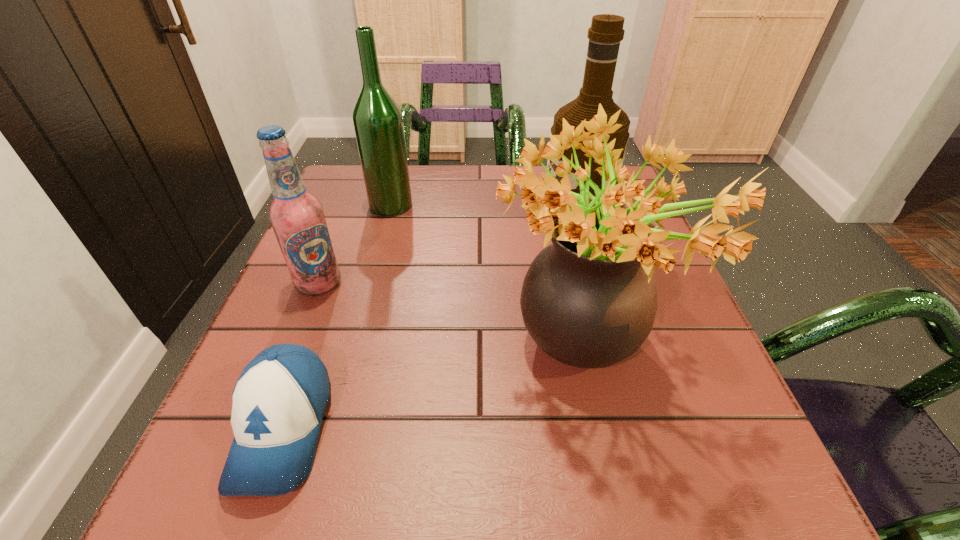
Locate an element on the screen. The height and width of the screenshot is (540, 960). free point at the near edge is located at coordinates (444, 487).

The image size is (960, 540). I want to click on vacant point at the left edge, so click(361, 301).

What are the coordinates of `free space at the right edge of the desktop` in the screenshot? It's located at (684, 321).

Identify the location of free space at the near right corner. (675, 495).

At what (x,y) coordinates should I click in order to perform the action: click on free space between the flower arrangement and the second alcohol from right to left. Please return your answer as a coordinate pair (x, y). The height and width of the screenshot is (540, 960). Looking at the image, I should click on (487, 280).

Where is `vacant space in between the leftmost alcohol and the flower arrangement`? The height and width of the screenshot is (540, 960). vacant space in between the leftmost alcohol and the flower arrangement is located at coordinates (450, 319).

Find the location of `vacant area that lies between the second alcohol from right to left and the baseball cap`. vacant area that lies between the second alcohol from right to left and the baseball cap is located at coordinates (337, 317).

Find the location of a particular element. Image resolution: width=960 pixels, height=540 pixels. blank region between the rightmost alcohol and the shortest object is located at coordinates (429, 322).

At what (x,y) coordinates should I click in order to perform the action: click on vacant area that lies between the rightmost alcohol and the shortest alcohol. Please return your answer as a coordinate pair (x, y). The image size is (960, 540). Looking at the image, I should click on (447, 249).

Locate an element on the screen. Image resolution: width=960 pixels, height=540 pixels. vacant space in between the rightmost alcohol and the second shortest object is located at coordinates (447, 249).